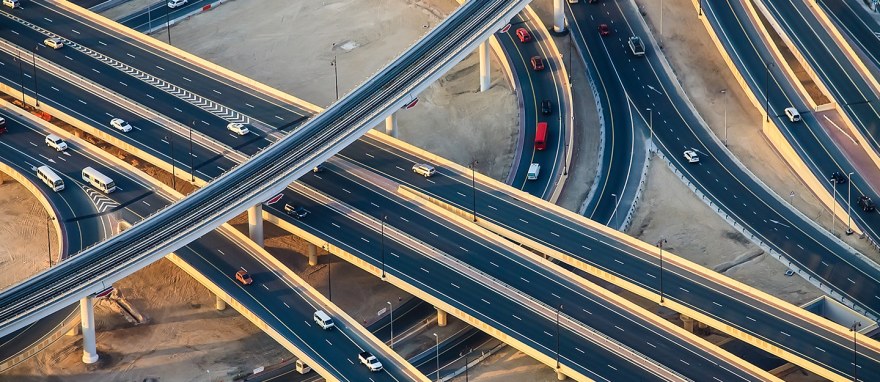
The image size is (880, 382). Find the location of `pillars`. pillars is located at coordinates (482, 66), (389, 121), (558, 10), (437, 315), (559, 375), (686, 323), (89, 329), (258, 225), (310, 258).